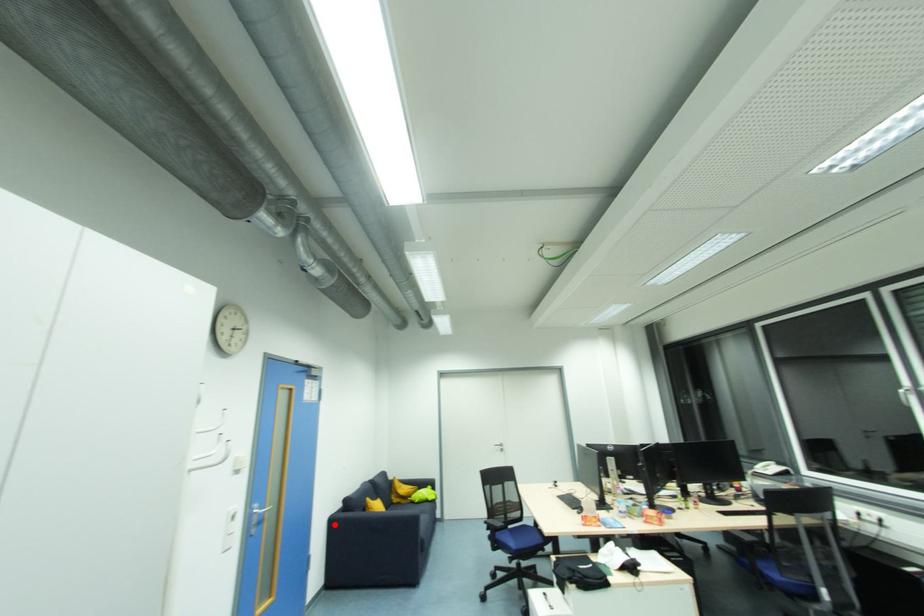
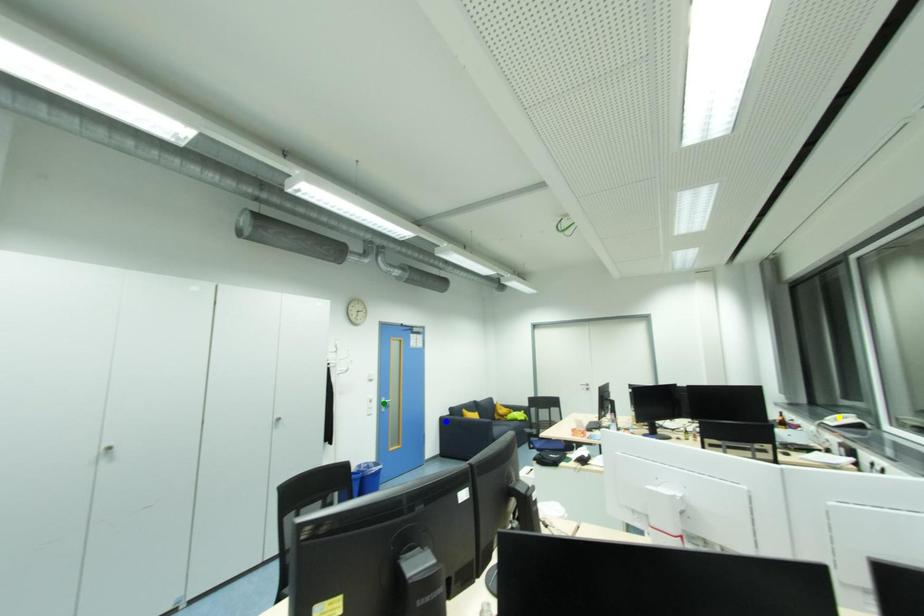
Question: I am providing you with two images of the same scene from different viewpoints. A red point is marked on the first image. You are given multiple points on the second image. Which spot in image 2 lines up with the point in image 1?

Choices:
 (A) yellow point
 (B) blue point
 (C) green point

Answer: (B)